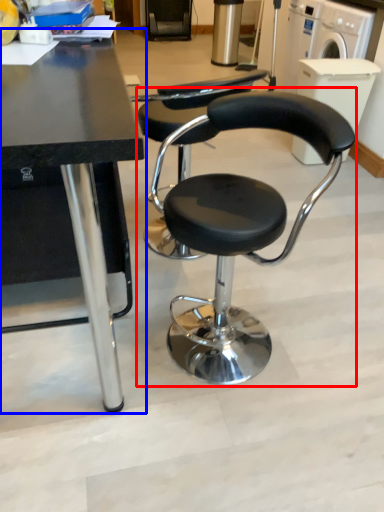
Question: Among these objects, which one is nearest to the camera, chair (highlighted by a red box) or table (highlighted by a blue box)?

Choices:
 (A) chair
 (B) table

Answer: (B)